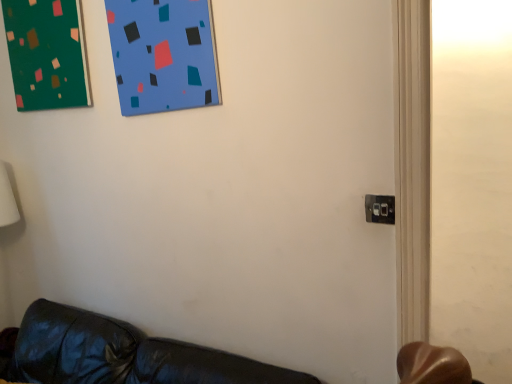
Question: Is black plastic electric outlet at lower right taller or shorter than green matte board at upper left?

Choices:
 (A) short
 (B) tall

Answer: (A)

Question: Do you think black plastic electric outlet at lower right is within green matte board at upper left, or outside of it?

Choices:
 (A) outside
 (B) inside

Answer: (A)

Question: Is point (390, 198) positioned closer to the camera than point (28, 3)?

Choices:
 (A) farther
 (B) closer

Answer: (B)

Question: Considering the relative positions of green matte board at upper left and black plastic electric outlet at lower right in the image provided, is green matte board at upper left to the left or to the right of black plastic electric outlet at lower right?

Choices:
 (A) left
 (B) right

Answer: (A)

Question: From the image's perspective, is green matte board at upper left above or below black plastic electric outlet at lower right?

Choices:
 (A) below
 (B) above

Answer: (B)

Question: In the image, is green matte board at upper left positioned in front of or behind black plastic electric outlet at lower right?

Choices:
 (A) front
 (B) behind

Answer: (B)

Question: In terms of width, does green matte board at upper left look wider or thinner when compared to black plastic electric outlet at lower right?

Choices:
 (A) wide
 (B) thin

Answer: (A)